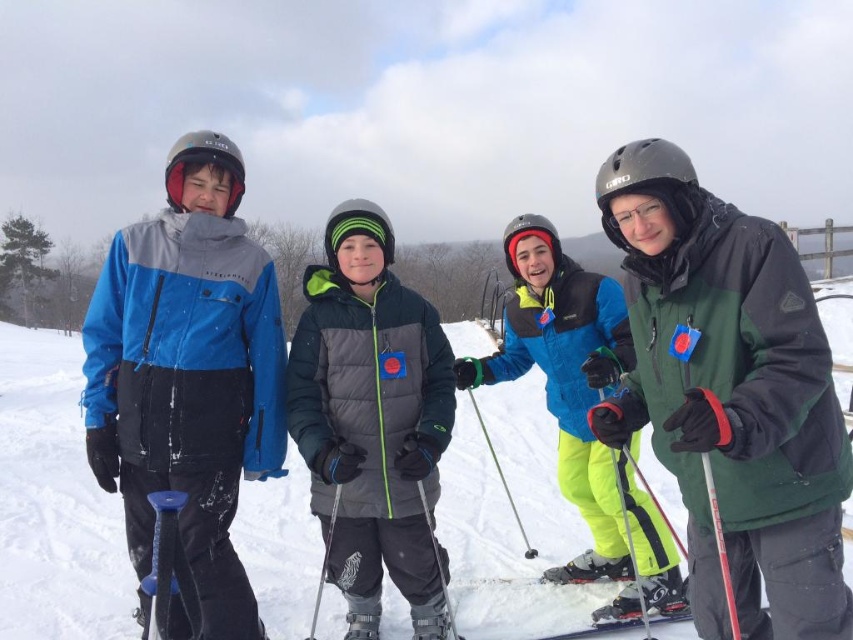
You are standing at the camera position and want to know how far the point at coordinates (724, 340) is from you. Can you determine the distance?

The point at coordinates (724, 340) is 9.09 feet away from the camera position.

You are planning to take a photo of the group on the snowy slope. If you want to focus on the person wearing the green matte jacket at center, where should you aim your camera relative to the other people in the scene?

The green matte jacket at center is located at point (730, 394), which means you should aim your camera towards the central area slightly to the right and lower part of the image to capture the person in focus.